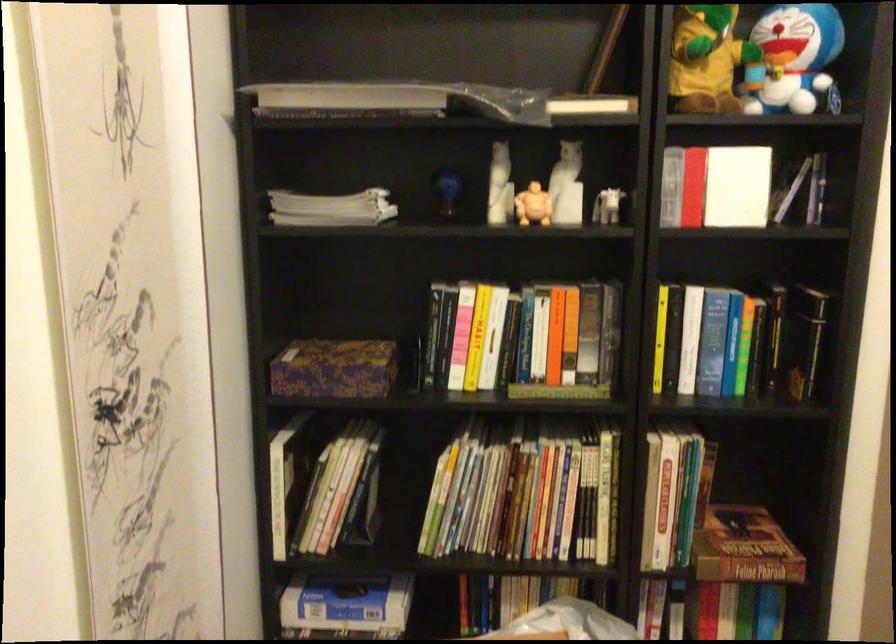
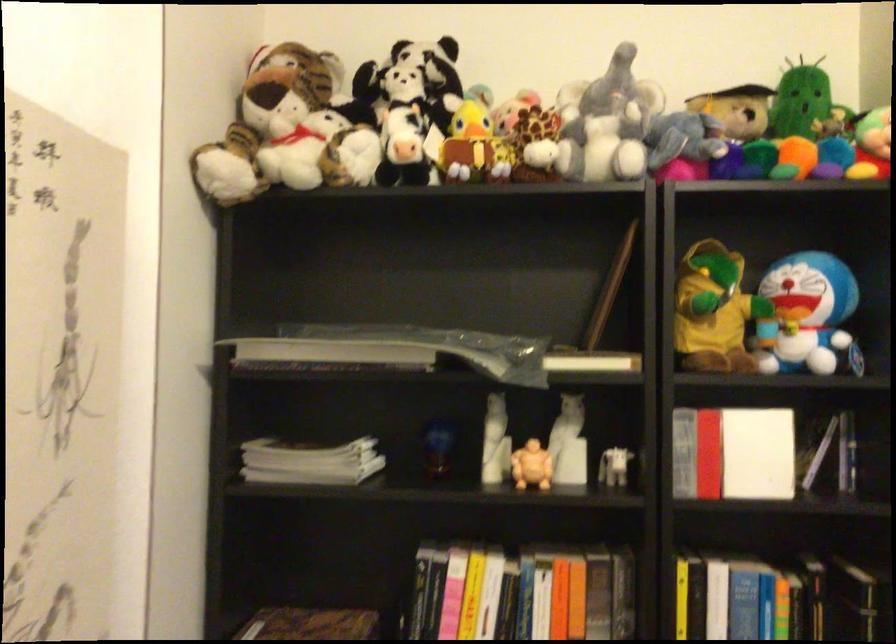
The point at (x=608, y=205) is marked in the first image. Where is the corresponding point in the second image?

(615, 468)